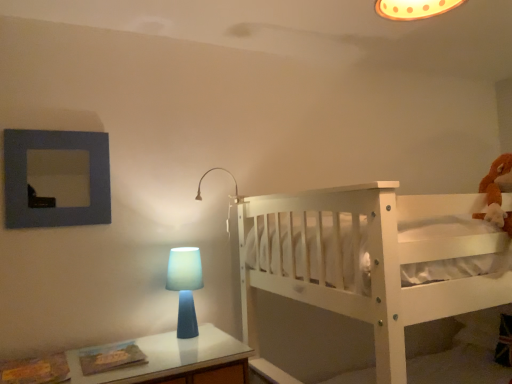
Question: Is matte white lamp at upper center oriented towards blue matte table lamp at center?

Choices:
 (A) no
 (B) yes

Answer: (A)

Question: Is blue matte table lamp at center a part of matte white lamp at upper center?

Choices:
 (A) yes
 (B) no

Answer: (B)

Question: From the image's perspective, does matte white lamp at upper center appear lower than blue matte table lamp at center?

Choices:
 (A) no
 (B) yes

Answer: (A)

Question: Can you confirm if matte white lamp at upper center is wider than blue matte table lamp at center?

Choices:
 (A) no
 (B) yes

Answer: (B)

Question: Can you confirm if matte white lamp at upper center is shorter than blue matte table lamp at center?

Choices:
 (A) yes
 (B) no

Answer: (A)

Question: In the image, is blue matte table lamp at center on the left side or the right side of white wooden bunk bed at right?

Choices:
 (A) right
 (B) left

Answer: (B)

Question: Looking at the image, does blue matte table lamp at center seem bigger or smaller compared to white wooden bunk bed at right?

Choices:
 (A) small
 (B) big

Answer: (A)

Question: From the image's perspective, relative to white wooden bunk bed at right, is blue matte table lamp at center above or below?

Choices:
 (A) below
 (B) above

Answer: (B)

Question: Choose the correct answer: Is blue matte table lamp at center inside white wooden bunk bed at right or outside it?

Choices:
 (A) outside
 (B) inside

Answer: (A)

Question: Looking at their shapes, would you say white wooden bunk bed at right is wider or thinner than matte white lamp at upper center?

Choices:
 (A) wide
 (B) thin

Answer: (A)

Question: Would you say white wooden bunk bed at right is to the left or to the right of matte white lamp at upper center in the picture?

Choices:
 (A) right
 (B) left

Answer: (A)

Question: From a real-world perspective, is white wooden bunk bed at right above or below matte white lamp at upper center?

Choices:
 (A) below
 (B) above

Answer: (A)

Question: Considering the positions of white wooden bunk bed at right and matte white lamp at upper center in the image, is white wooden bunk bed at right taller or shorter than matte white lamp at upper center?

Choices:
 (A) short
 (B) tall

Answer: (B)

Question: In the image, is matte white lamp at upper center positioned in front of or behind blue matte picture frame at upper left?

Choices:
 (A) behind
 (B) front

Answer: (A)

Question: Is matte white lamp at upper center bigger or smaller than blue matte picture frame at upper left?

Choices:
 (A) big
 (B) small

Answer: (B)